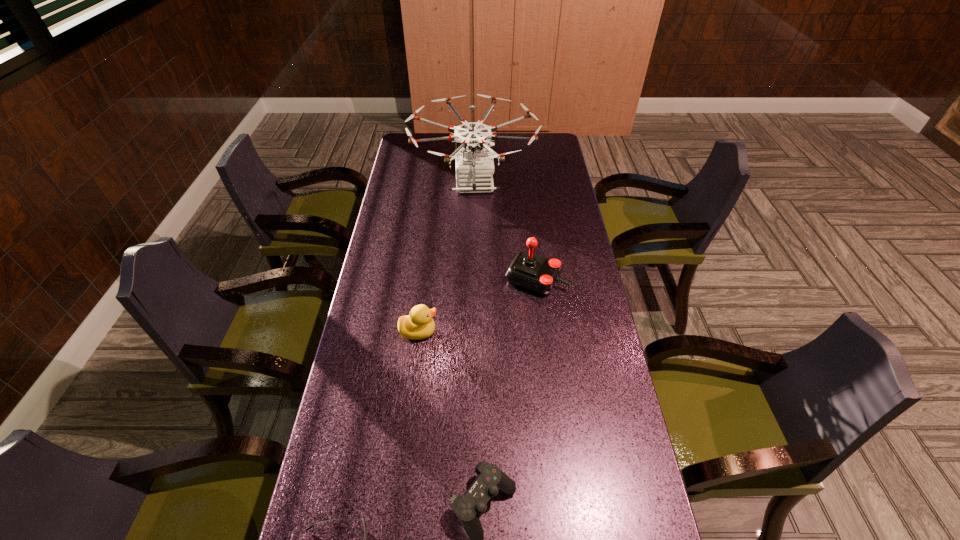
Where is `the farthest object`? the farthest object is located at coordinates (474, 167).

The width and height of the screenshot is (960, 540). What are the coordinates of `the tallest object` in the screenshot? It's located at (474, 167).

The image size is (960, 540). Find the location of `the second farthest object`. the second farthest object is located at coordinates (532, 272).

Locate an element on the screen. The width and height of the screenshot is (960, 540). the second tallest object is located at coordinates (532, 272).

Where is `the third nearest object`? This screenshot has width=960, height=540. the third nearest object is located at coordinates (419, 324).

Where is `duckling`? Image resolution: width=960 pixels, height=540 pixels. duckling is located at coordinates (419, 324).

At what (x,y) coordinates should I click in order to perform the action: click on vacant space situated 0.340m on the front of the tallest object. Please return your answer as a coordinate pair (x, y). Image resolution: width=960 pixels, height=540 pixels. Looking at the image, I should click on (471, 290).

Identify the location of vacant space located on the back of the fourth nearest object. (528, 214).

Image resolution: width=960 pixels, height=540 pixels. In order to click on free spot located on the face of the third shortest object in this screenshot , I will do `click(517, 332)`.

Locate an element on the screen. The image size is (960, 540). object at the far edge is located at coordinates click(474, 167).